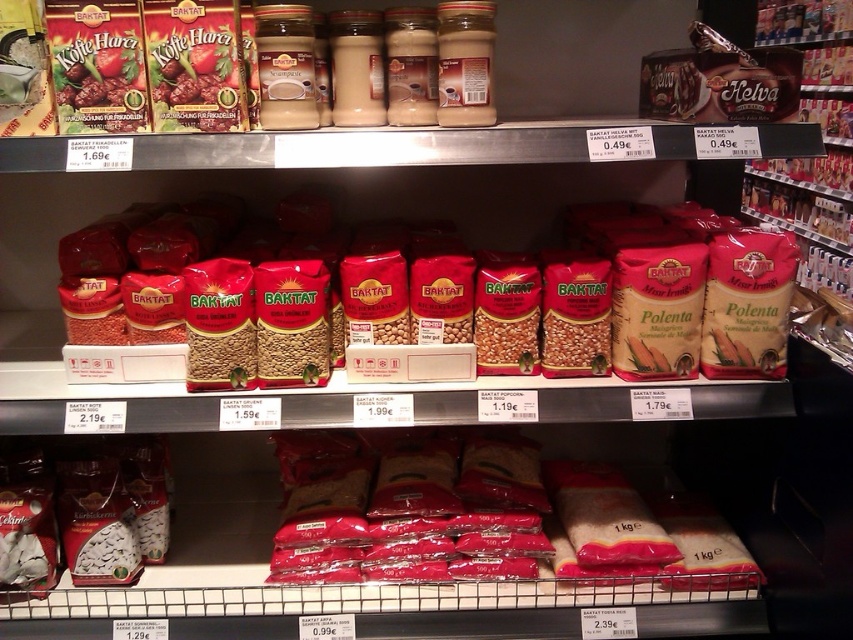
You are a grocery store employee organizing the top shelf. You have two products to place there, the red matte beans at center and the red matte rice at center. Considering their sizes, which product requires a larger storage space?

The red matte beans at center requires a larger storage space because it has a larger size compared to the red matte rice at center.

You are a customer in a grocery store looking at the middle section of the shelf. You see two products, the red matte beans at center and the red matte rice at center. Which one is taller?

The red matte beans at center is taller than the red matte rice at center.